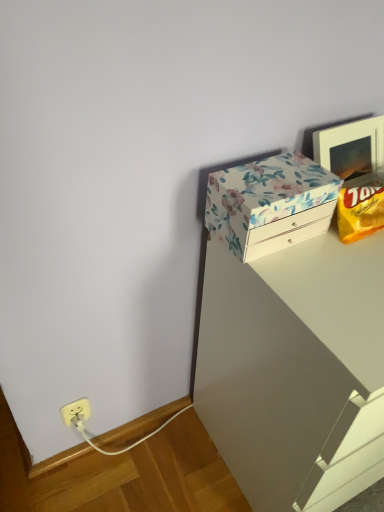
Question: Considering the positions of yellow matte chip bag at upper right and white glossy vanity at upper right in the image, is yellow matte chip bag at upper right wider or thinner than white glossy vanity at upper right?

Choices:
 (A) thin
 (B) wide

Answer: (A)

Question: Do you think yellow matte chip bag at upper right is within white glossy vanity at upper right, or outside of it?

Choices:
 (A) inside
 (B) outside

Answer: (B)

Question: Estimate the real-world distances between objects in this image. Which object is closer to the floral paper-covered box at upper right?

Choices:
 (A) yellow matte chip bag at upper right
 (B) white glossy vanity at upper right

Answer: (A)

Question: Based on their relative distances, which object is farther from the yellow matte chip bag at upper right?

Choices:
 (A) white glossy vanity at upper right
 (B) floral paper-covered box at upper right

Answer: (A)